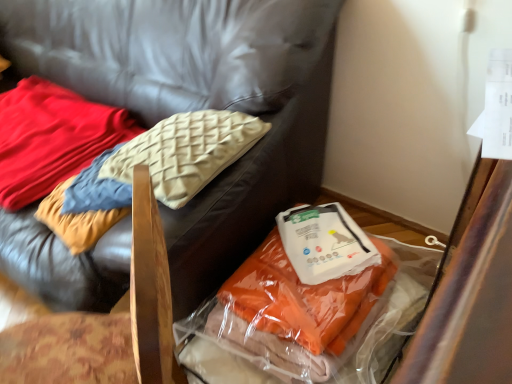
Question: Can you confirm if white plastic kit at lower right is positioned to the right of translucent plastic bag at lower right, which is the 1th furniture from left to right?

Choices:
 (A) yes
 (B) no

Answer: (A)

Question: Does white plastic kit at lower right contain translucent plastic bag at lower right, which is the 1th furniture from left to right?

Choices:
 (A) no
 (B) yes

Answer: (A)

Question: Is white plastic kit at lower right wider than translucent plastic bag at lower right, the 2th furniture when ordered from right to left?

Choices:
 (A) no
 (B) yes

Answer: (A)

Question: Can you confirm if white plastic kit at lower right is taller than translucent plastic bag at lower right, the 2th furniture when ordered from right to left?

Choices:
 (A) yes
 (B) no

Answer: (B)

Question: Considering the relative sizes of white plastic kit at lower right and translucent plastic bag at lower right, the 2th furniture when ordered from right to left, in the image provided, is white plastic kit at lower right smaller than translucent plastic bag at lower right, the 2th furniture when ordered from right to left,?

Choices:
 (A) no
 (B) yes

Answer: (B)

Question: Is point click(x=52, y=362) closer or farther from the camera than point click(x=348, y=215)?

Choices:
 (A) closer
 (B) farther

Answer: (A)

Question: In terms of height, does velvet cushion at upper left, the 2th furniture viewed from the left, look taller or shorter compared to white plastic kit at lower right?

Choices:
 (A) short
 (B) tall

Answer: (B)

Question: Looking at their shapes, would you say velvet cushion at upper left, which is the 1th furniture from right to left, is wider or thinner than white plastic kit at lower right?

Choices:
 (A) wide
 (B) thin

Answer: (A)

Question: From a real-world perspective, relative to white plastic kit at lower right, is velvet cushion at upper left, the 2th furniture viewed from the left, vertically above or below?

Choices:
 (A) above
 (B) below

Answer: (A)

Question: Does point (16, 102) appear closer or farther from the camera than point (329, 332)?

Choices:
 (A) farther
 (B) closer

Answer: (A)

Question: Looking at the image, does soft cream pillow at upper left seem bigger or smaller compared to orange fabric at lower right?

Choices:
 (A) small
 (B) big

Answer: (A)

Question: Considering their positions, is soft cream pillow at upper left located in front of or behind orange fabric at lower right?

Choices:
 (A) behind
 (B) front

Answer: (A)

Question: From their relative heights in the image, would you say soft cream pillow at upper left is taller or shorter than orange fabric at lower right?

Choices:
 (A) tall
 (B) short

Answer: (B)

Question: Looking at their shapes, would you say orange fabric at lower right is wider or thinner than soft cream pillow at upper left?

Choices:
 (A) thin
 (B) wide

Answer: (B)

Question: Is point (368, 297) closer or farther from the camera than point (10, 170)?

Choices:
 (A) closer
 (B) farther

Answer: (A)